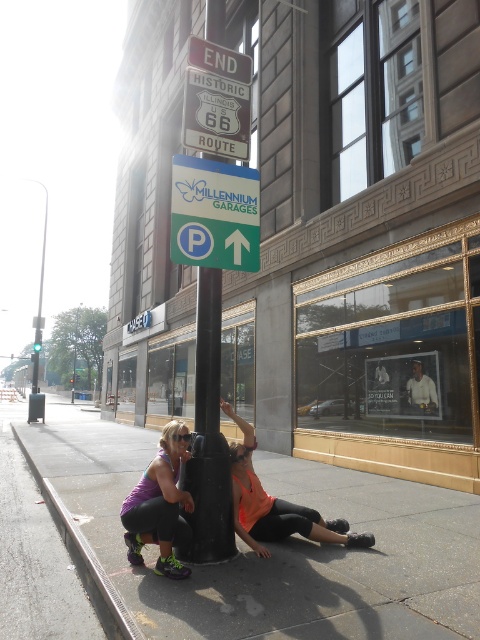
Can you confirm if gray concrete sidewalk at lower center is positioned below gray concrete curb at lower left?

Correct, gray concrete sidewalk at lower center is located below gray concrete curb at lower left.

Is point (294, 605) positioned before point (72, 529)?

That is True.

Locate an element on the screen. gray concrete sidewalk at lower center is located at coordinates (276, 547).

Does neon orange fabric at center have a lesser width compared to metallic silver sign at center?

Incorrect, neon orange fabric at center's width is not less than metallic silver sign at center's.

Does neon orange fabric at center have a larger size compared to metallic silver sign at center?

Indeed, neon orange fabric at center has a larger size compared to metallic silver sign at center.

This screenshot has height=640, width=480. Describe the element at coordinates (275, 504) in the screenshot. I see `neon orange fabric at center` at that location.

Identify the location of neon orange fabric at center. (275, 504).

Which is more to the left, green plastic parking sign at center or neon orange fabric at center?

From the viewer's perspective, green plastic parking sign at center appears more on the left side.

Between point (188, 225) and point (274, 516), which one is positioned in front?

Point (188, 225) is more forward.

Which is in front, point (207, 170) or point (238, 515)?

Positioned in front is point (238, 515).

Locate an element on the screen. Image resolution: width=480 pixels, height=640 pixels. green plastic parking sign at center is located at coordinates (215, 214).